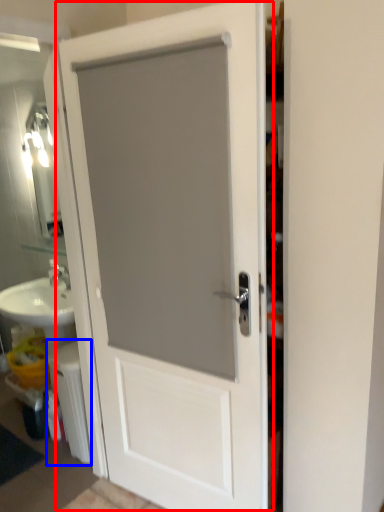
Question: Which object appears farthest to the camera in this image, door (highlighted by a red box) or radiator (highlighted by a blue box)?

Choices:
 (A) door
 (B) radiator

Answer: (B)